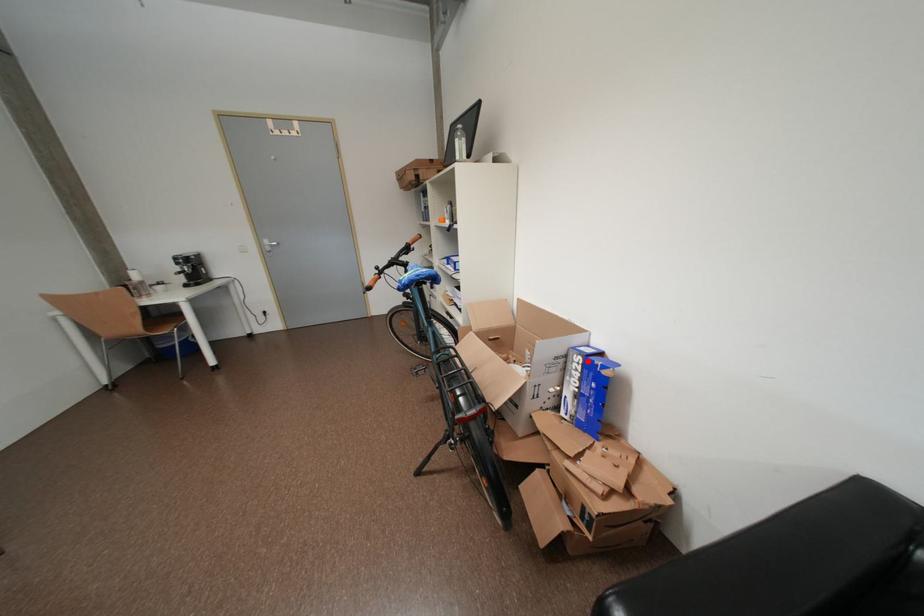
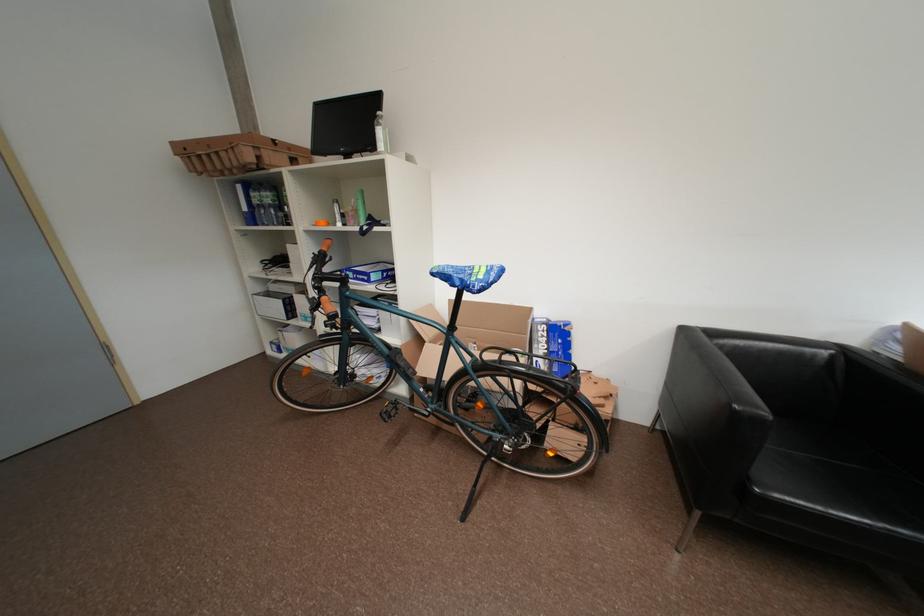
Question: A red point is marked in image1. In image2, is the corresponding 3D point closer to the camera or farther? Reply with the corresponding letter.

Choices:
 (A) The corresponding 3D point is closer.
 (B) The corresponding 3D point is farther.

Answer: (B)